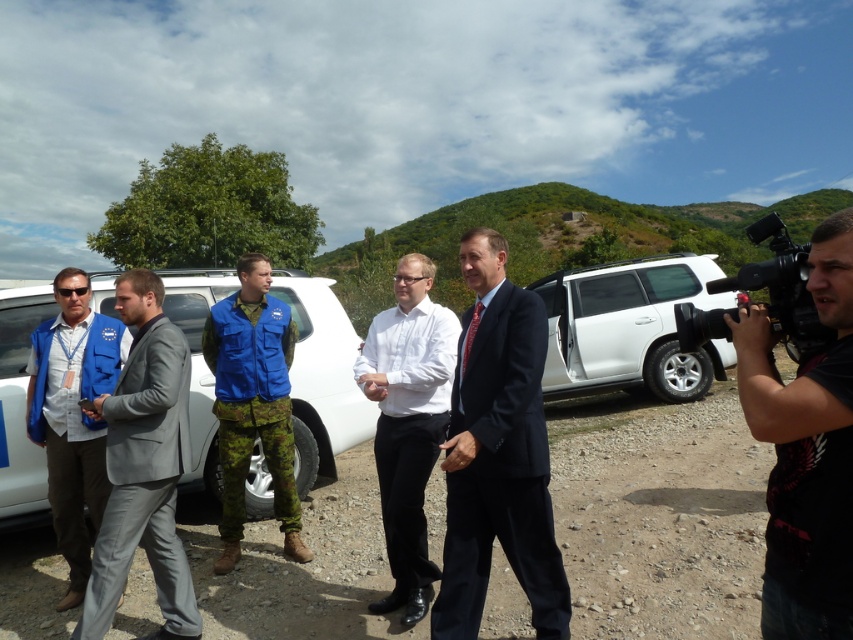
Can you confirm if gray suit at center is positioned to the right of camo fabric vest at center?

In fact, gray suit at center is to the left of camo fabric vest at center.

Does gray suit at center appear under camo fabric vest at center?

Indeed, gray suit at center is positioned under camo fabric vest at center.

Is point (158, 428) in front of point (250, 388)?

Yes, it is.

You are a GUI agent. You are given a task and a screenshot of the screen. Output one action in this format:
    pyautogui.click(x=<x>, y=<y>)
    Task: Click on the gray suit at center
    
    Given the screenshot: What is the action you would take?
    pyautogui.click(x=144, y=467)

Measure the distance between gray suit at center and black plastic video camera at right.

3.07 meters

Based on the photo, is gray suit at center smaller than black plastic video camera at right?

Yes, gray suit at center is smaller than black plastic video camera at right.

Is point (125, 273) closer to viewer compared to point (776, 220)?

No.

The image size is (853, 640). I want to click on gray suit at center, so click(144, 467).

This screenshot has width=853, height=640. What do you see at coordinates (321, 378) in the screenshot? I see `white matte van at center` at bounding box center [321, 378].

Does white matte van at center come behind camo fabric vest at center?

That is True.

Who is more distant from viewer, (9, 484) or (216, 374)?

Positioned behind is point (9, 484).

Image resolution: width=853 pixels, height=640 pixels. Identify the location of white matte van at center. 321,378.